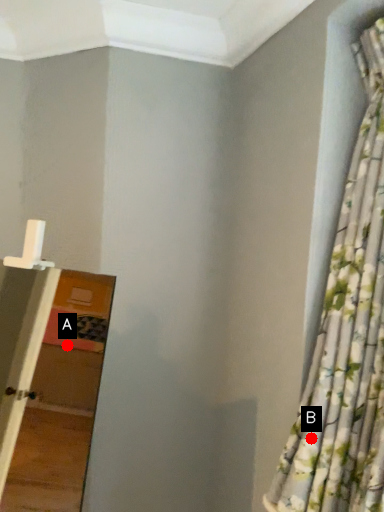
Question: Two points are circled on the image, labeled by A and B beside each circle. Which point is closer to the camera?

Choices:
 (A) A is closer
 (B) B is closer

Answer: (B)